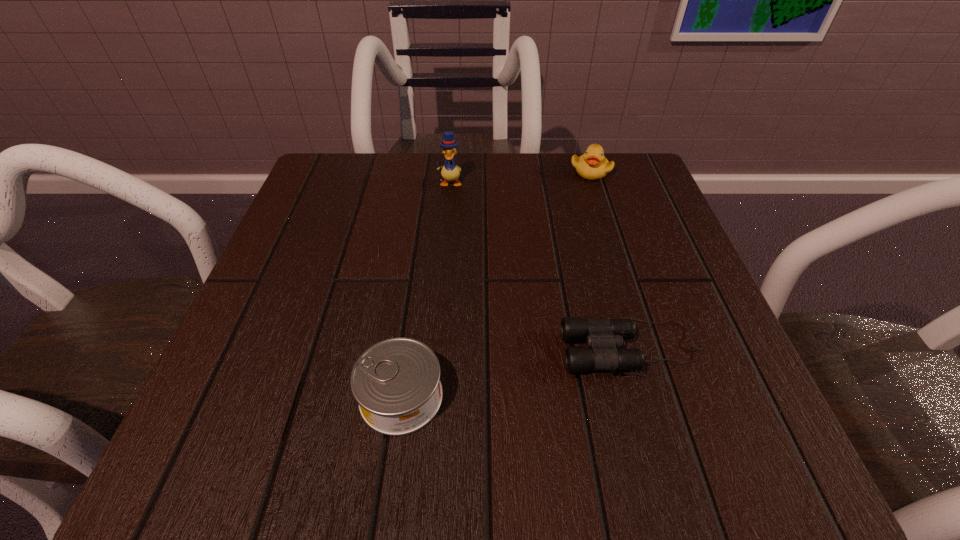
This screenshot has width=960, height=540. In order to click on free spot between the shorter duckling and the can in this screenshot , I will do `click(496, 284)`.

Locate which object is the second closest to the binoculars. Please provide its 2D coordinates. Your answer should be formatted as a tuple, i.e. [(x, y)], where the tuple contains the x and y coordinates of a point satisfying the conditions above.

[(592, 165)]

Select which object is the third closest to the can. Please provide its 2D coordinates. Your answer should be formatted as a tuple, i.e. [(x, y)], where the tuple contains the x and y coordinates of a point satisfying the conditions above.

[(592, 165)]

The height and width of the screenshot is (540, 960). I want to click on vacant space that satisfies the following two spatial constraints: 1. at the eyepiece of the shortest object; 2. on the front side of the can, so click(x=645, y=396).